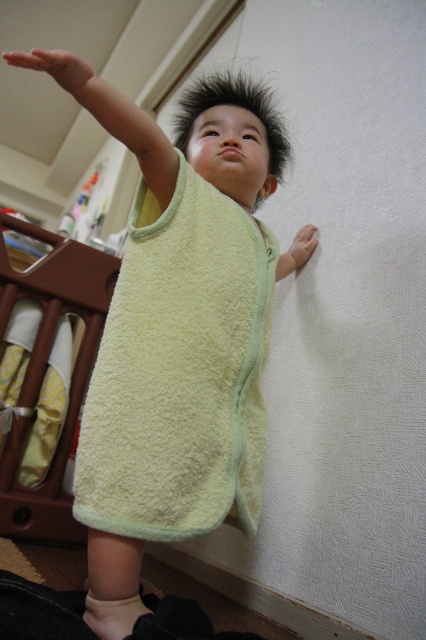
Is yellow towel at upper left in front of matte yellow towel at center?

Yes.

Between yellow towel at upper left and matte yellow towel at center, which one has less height?

matte yellow towel at center is shorter.

Describe the element at coordinates (111, 115) in the screenshot. The image size is (426, 640). I see `yellow towel at upper left` at that location.

Locate an element on the screen. This screenshot has width=426, height=640. yellow towel at upper left is located at coordinates (111, 115).

Is soft yellow towel at center thinner than matte yellow towel at upper left?

In fact, soft yellow towel at center might be wider than matte yellow towel at upper left.

Which is behind, point (229, 420) or point (86, 65)?

Point (229, 420)

Is point (149, 468) positioned before point (55, 74)?

No, it is not.

The image size is (426, 640). Find the location of `soft yellow towel at center`. soft yellow towel at center is located at coordinates (180, 371).

Can you confirm if soft yellow towel at center is positioned above matte yellow towel at center?

No, soft yellow towel at center is not above matte yellow towel at center.

At what (x,y) coordinates should I click in order to perform the action: click on soft yellow towel at center. Please return your answer as a coordinate pair (x, y). The image size is (426, 640). Looking at the image, I should click on (180, 371).

Identify the location of soft yellow towel at center. (180, 371).